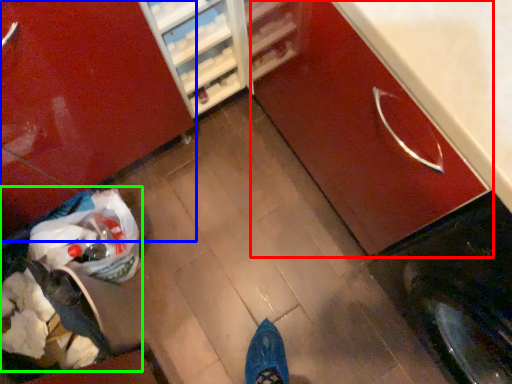
Question: Which object is the closest to the cabinetry (highlighted by a red box)? Choose among these: cabinetry (highlighted by a blue box) or garbage (highlighted by a green box).

Choices:
 (A) cabinetry
 (B) garbage

Answer: (A)